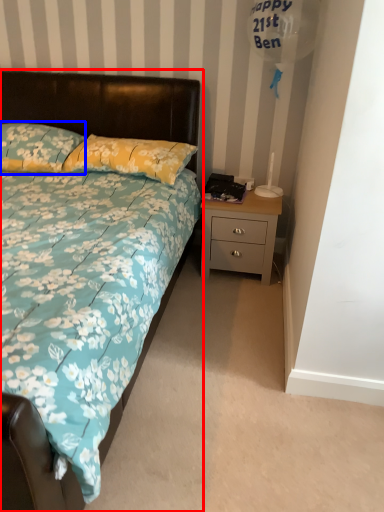
Question: Which object appears closest to the camera in this image, bed (highlighted by a red box) or pillow (highlighted by a blue box)?

Choices:
 (A) bed
 (B) pillow

Answer: (A)